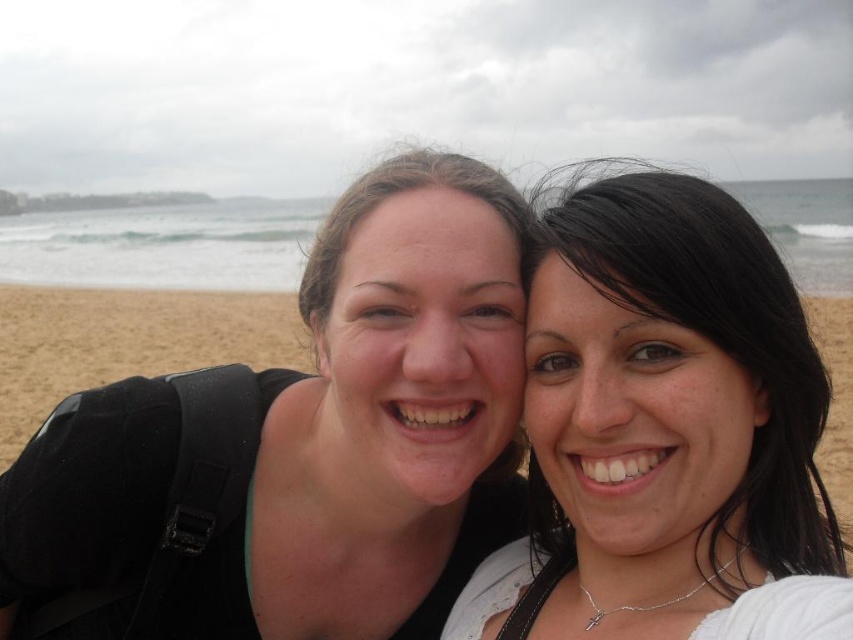
You are a photographer trying to capture both the matte black backpack at left and the smooth white blouse at center in a single frame. Based on their sizes, which object should you focus on first to ensure both fit in the shot?

The matte black backpack at left occupies less space than the smooth white blouse at center, so you should focus on the larger object, the smooth white blouse at center, first to ensure both fit in the shot.

You are a photographer trying to capture the perfect shot of the matte black backpack at left. According to the coordinates provided, where should you position your camera to ensure the backpack is centered in the frame?

The matte black backpack at left is located at coordinates point [299,445], so positioning the camera at those coordinates would center it in the frame.

You are a photographer trying to capture a clear shot of the smooth white blouse at center without the matte black backpack at left blocking it. Based on the scene, what adjustment should you make to your camera angle?

The smooth white blouse at center is behind the matte black backpack at left, so you should move your camera angle to the right to avoid the backpack blocking the blouse.